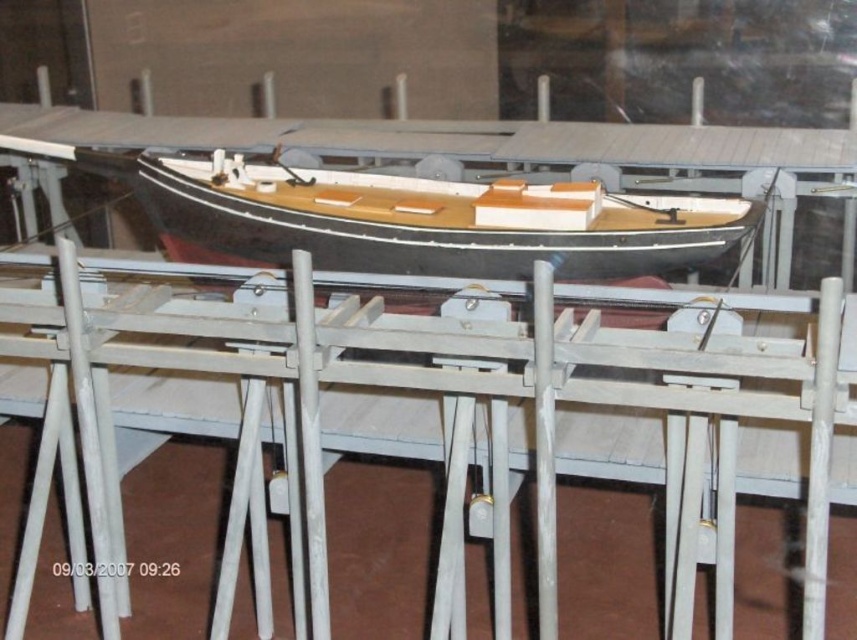
You are an interior designer planning to place a new sculpture between the white matte rail at center and the wooden boat at center. Given their widths, which object should the sculpture be placed closer to in order to maintain balance?

The white matte rail at center has a larger width than the wooden boat at center. To maintain balance, the sculpture should be placed closer to the wooden boat at center since it is narrower, creating a visually balanced composition.

You are an exhibit designer who needs to ensure the wooden boat at center is visible to visitors. Since the white matte rail at center is in the way, where should you adjust the rail to allow a clear view of the boat?

The white matte rail at center is positioned under the wooden boat at center, so moving the rail to the side or behind the boat would provide a clear view.